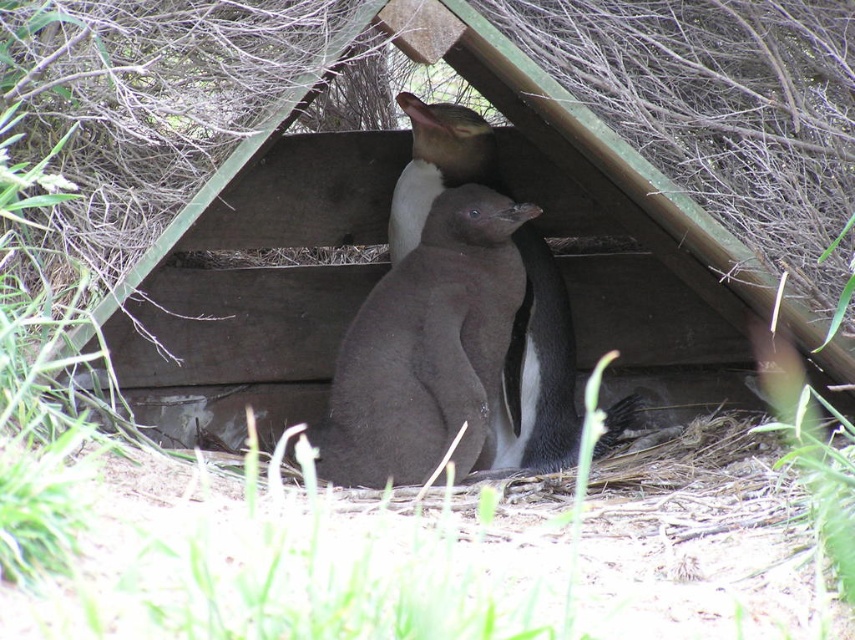
You are a wildlife photographer aiming to capture a photo of the dark gray matte penguin at center and the brown fuzzy penguin at center. Since you want to ensure both penguins are fully visible in the frame, which penguin should you position closer to the front of the shelter to avoid blocking the other?

The dark gray matte penguin at center is taller than the brown fuzzy penguin at center, so positioning the brown fuzzy penguin at center closer to the front of the shelter will prevent it from being blocked by the taller penguin behind it.

You are standing at the camera position and want to feed the dark gray matte penguin at center. If your arm can reach 9 feet, can you reach the penguin?

The dark gray matte penguin at center and camera are 9.38 feet apart from each other. Since your arm can reach 9 feet, you cannot reach the penguin as the distance is slightly more than your arm length.